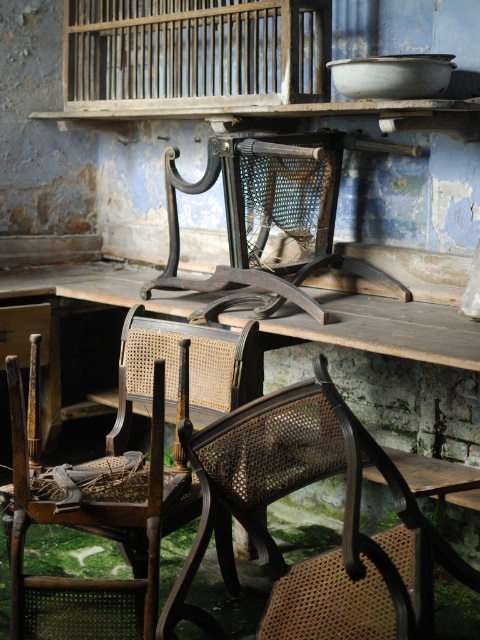
Question: Does brown cane chair at center have a smaller size compared to woven cane chair at center?

Choices:
 (A) yes
 (B) no

Answer: (A)

Question: Which object is closer to the camera taking this photo?

Choices:
 (A) woven wood birdcage at center
 (B) woven cane chair at center
 (C) wooden cage at upper center
 (D) brown cane chair at center

Answer: (D)

Question: Considering the real-world distances, which object is closest to the wooden cage at upper center?

Choices:
 (A) woven cane chair at center
 (B) brown cane chair at center
 (C) woven wood birdcage at center

Answer: (C)

Question: Does wooden cage at upper center appear over woven cane chair at center?

Choices:
 (A) yes
 (B) no

Answer: (A)

Question: Among these points, which one is nearest to the camera?

Choices:
 (A) (13, 596)
 (B) (216, 81)

Answer: (A)

Question: Can you confirm if brown cane chair at center is positioned above wooden cage at upper center?

Choices:
 (A) no
 (B) yes

Answer: (A)